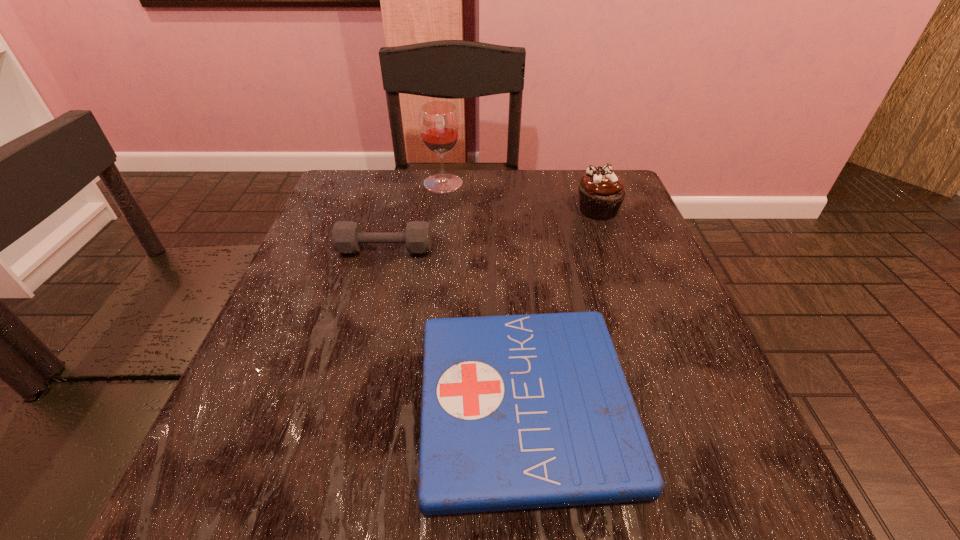
The width and height of the screenshot is (960, 540). I want to click on free space between the third shortest object and the shortest object, so click(x=562, y=307).

Locate an element on the screen. Image resolution: width=960 pixels, height=540 pixels. free spot between the tallest object and the second farthest object is located at coordinates (520, 197).

You are a GUI agent. You are given a task and a screenshot of the screen. Output one action in this format:
    pyautogui.click(x=<x>, y=<y>)
    Task: Click on the object that stands as the third closest to the third shortest object
    This screenshot has height=540, width=960.
    Given the screenshot: What is the action you would take?
    pyautogui.click(x=347, y=237)

I want to click on object that can be found as the closest to the third nearest object, so click(x=439, y=124).

At what (x,y) coordinates should I click in order to perform the action: click on vacant point that satisfies the following two spatial constraints: 1. on the back side of the dumbbell; 2. on the right side of the wineglass. Please return your answer as a coordinate pair (x, y). This screenshot has height=540, width=960. Looking at the image, I should click on (402, 183).